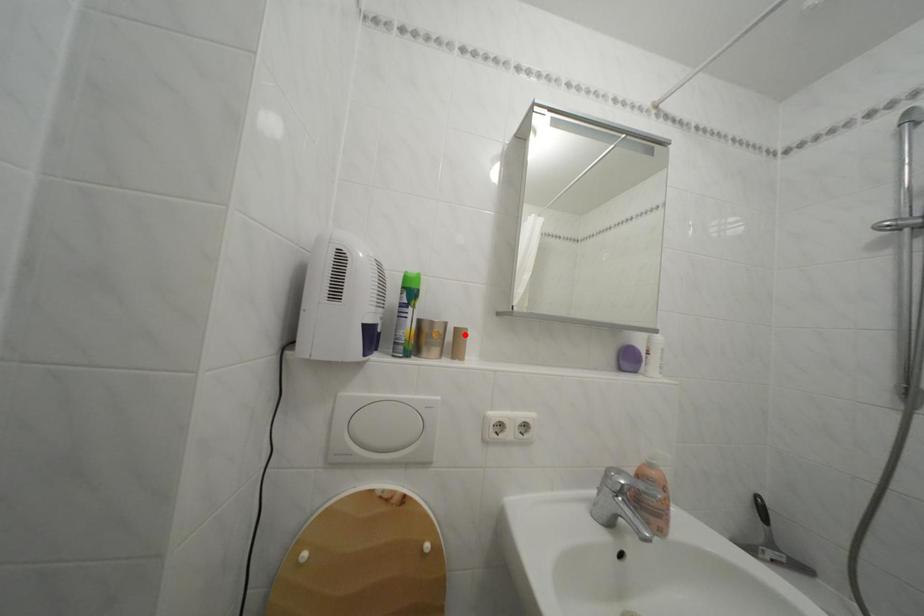
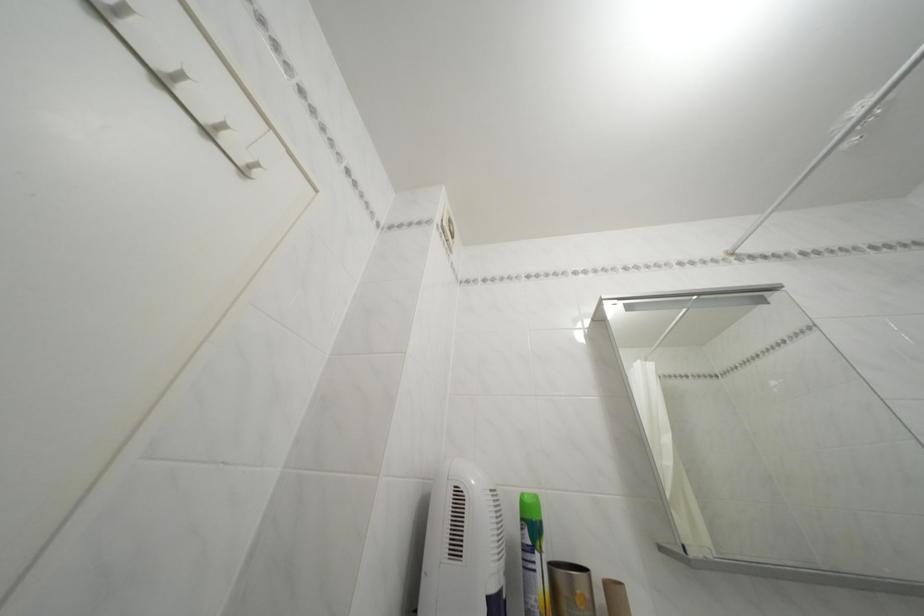
Where in the second image is the point corresponding to the highlighted location from the first image?

(614, 591)